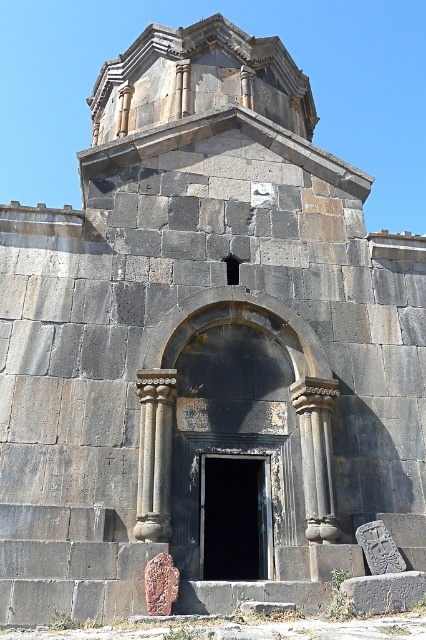
Does dark gray stone column at center appear under black stone column at center?

No, dark gray stone column at center is not below black stone column at center.

Who is more distant from viewer, [146,404] or [307,483]?

The point [146,404] is behind.

Find the location of a particular element. dark gray stone column at center is located at coordinates (155, 452).

Consider the image. How far apart are black stone door at center and black stone column at center?

The distance of black stone door at center from black stone column at center is 6.11 meters.

Does black stone door at center have a larger size compared to black stone column at center?

No.

Identify the location of black stone door at center. The width and height of the screenshot is (426, 640). (235, 516).

Between black stone door at center and dark gray stone column at center, which one has less height?

dark gray stone column at center

Is black stone door at center positioned behind dark gray stone column at center?

Yes, black stone door at center is behind dark gray stone column at center.

Is point (221, 490) closer to viewer compared to point (149, 499)?

No.

At what (x,y) coordinates should I click in order to perform the action: click on black stone door at center. Please return your answer as a coordinate pair (x, y). This screenshot has width=426, height=640. Looking at the image, I should click on (235, 516).